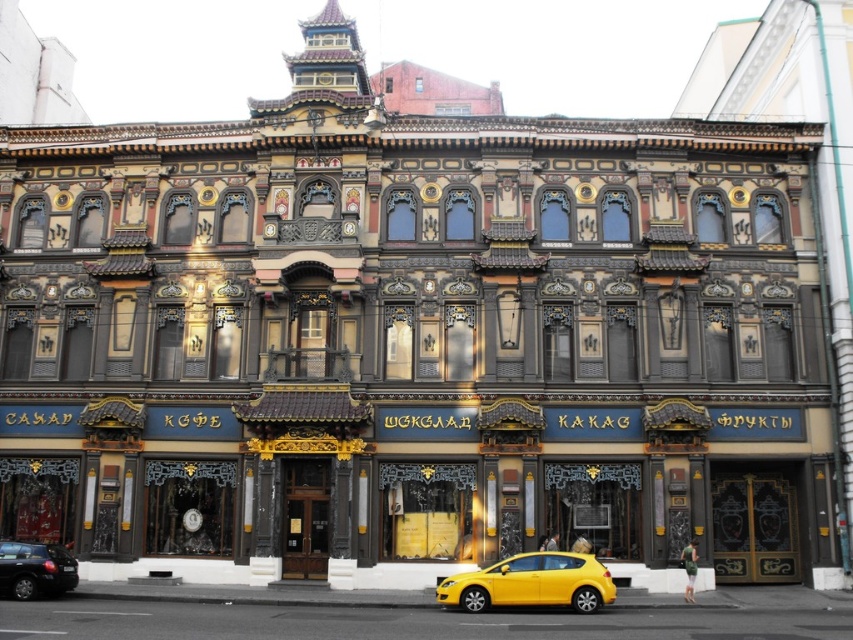
Question: Is metallic yellow car at lower center closer to the viewer compared to black matte car at lower left?

Choices:
 (A) yes
 (B) no

Answer: (A)

Question: Where is metallic yellow car at lower center located in relation to black matte car at lower left in the image?

Choices:
 (A) left
 (B) right

Answer: (B)

Question: Is metallic yellow car at lower center smaller than black matte car at lower left?

Choices:
 (A) no
 (B) yes

Answer: (A)

Question: Among these objects, which one is farthest from the camera?

Choices:
 (A) black matte car at lower left
 (B) metallic yellow car at lower center

Answer: (A)

Question: Which point is closer to the camera taking this photo?

Choices:
 (A) (9, 589)
 (B) (593, 556)

Answer: (A)

Question: Among these points, which one is nearest to the camera?

Choices:
 (A) (32, 561)
 (B) (479, 602)

Answer: (B)